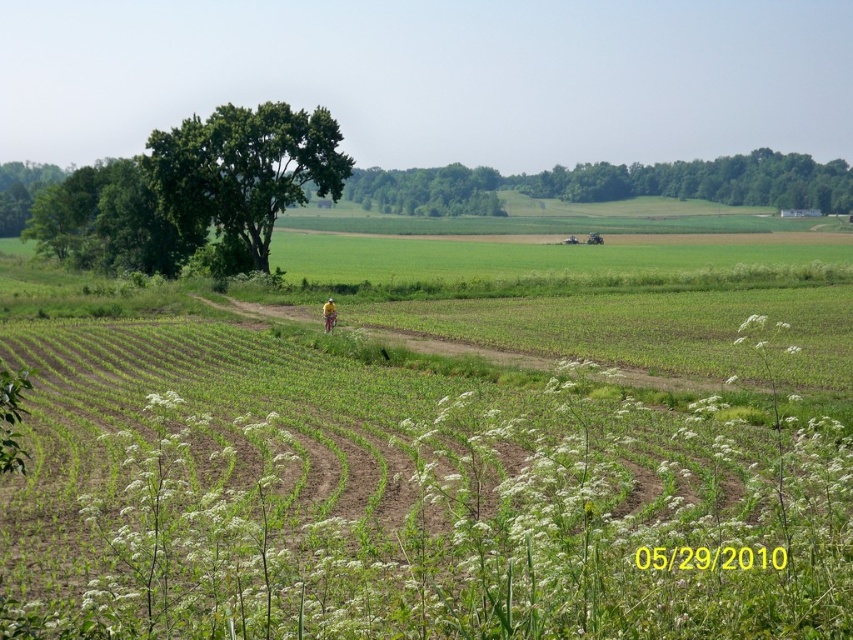
You are a farmer planning to install a sprinkler system between the white fluffy plant at center and the green leafy tree at upper center. The sprinkler has a maximum range of 700 feet. Will the sprinkler be able to water both areas?

The white fluffy plant at center and green leafy tree at upper center are 729.59 feet apart from each other. Since the sprinkler has a maximum range of 700 feet, it cannot reach the full distance between them, so it won

You are a farmer checking the field. You notice the white fluffy plant at center and the yellow fabric at center. Which one is wider?

The white fluffy plant at center is wider than the yellow fabric at center.

Consider the image. You are a farmer checking your crops and notice the white fluffy plant at center and the green leafy tree at center in your field. Which object is blocking the sunlight for the other?

The green leafy tree at center is blocking the sunlight from reaching the white fluffy plant at center because the white fluffy plant at center is positioned under the green leafy tree at center.